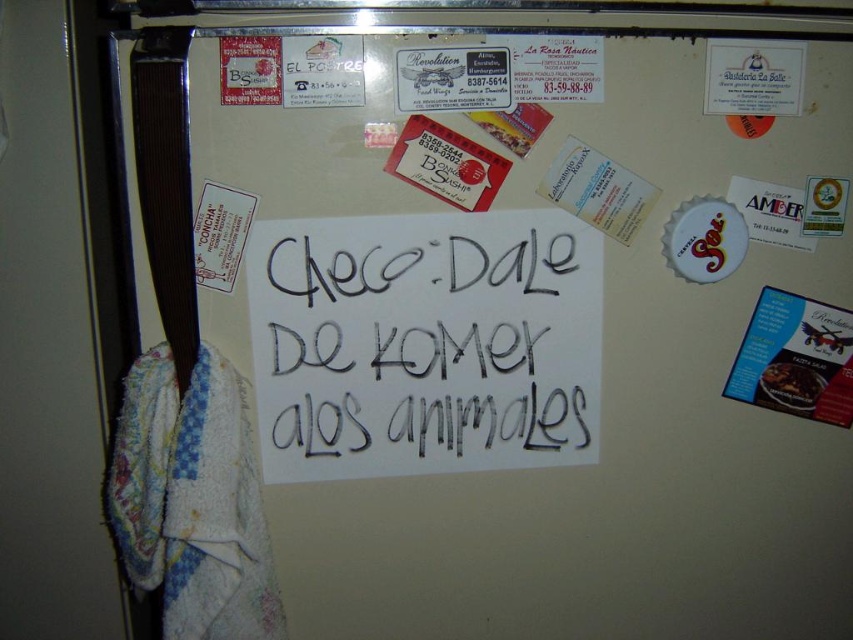
You are organizing the items on the refrigerator door. You need to place a new magnet between the white paper at center and the black glossy food at upper right. Based on their positions, where should you place the new magnet?

The white paper at center is closer to the viewer than the black glossy food at upper right, so you should place the new magnet between them by positioning it closer to the white paper at center to maintain the spatial order.

You are standing in front of the refrigerator and notice two points marked on the door. The first point is at coordinate point(221,484) and the second is at point(792,365). Which point is closer to you?

Point(221,484) is closer to you because it is in front of point(792,365).

You are organizing the items on the refrigerator door. You need to place a new magnet that is 10 inches wide. The white fluffy towel at left and the black glossy food at upper right are already there. Which existing item has a larger width to help you decide where to place the new magnet?

The white fluffy towel at left has a larger width than the black glossy food at upper right, so you should place the new magnet near the black glossy food at upper right to avoid overlapping with the wider towel.